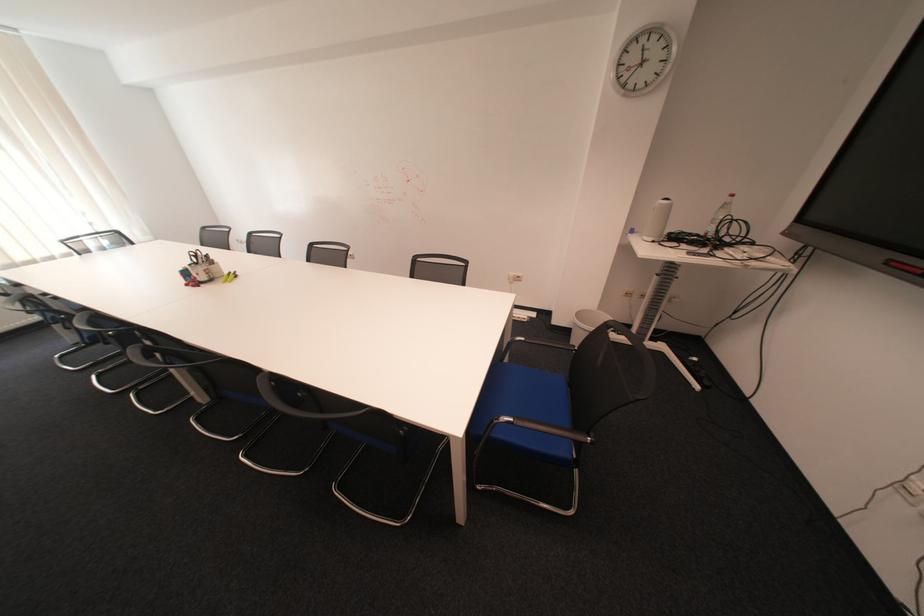
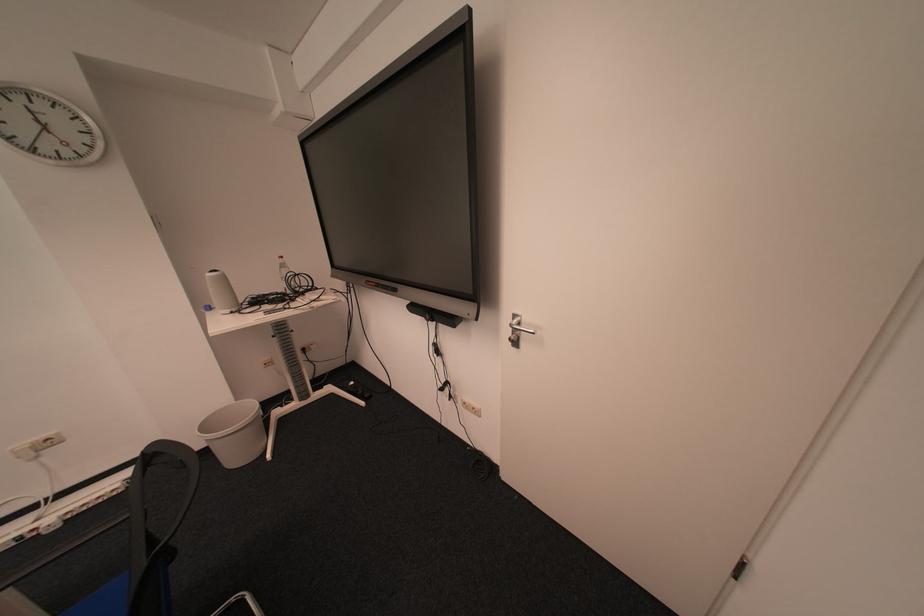
The point at (590, 315) is marked in the first image. Where is the corresponding point in the second image?

(216, 426)